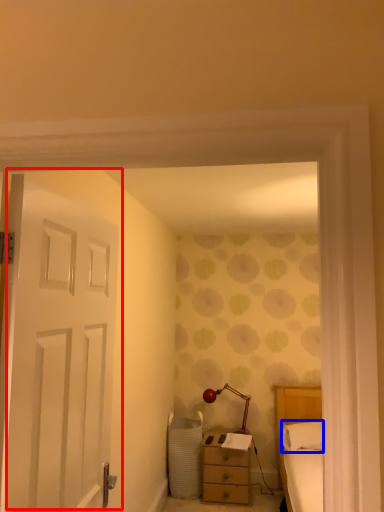
Question: Among these objects, which one is farthest to the camera, door (highlighted by a red box) or throw pillow (highlighted by a blue box)?

Choices:
 (A) door
 (B) throw pillow

Answer: (B)